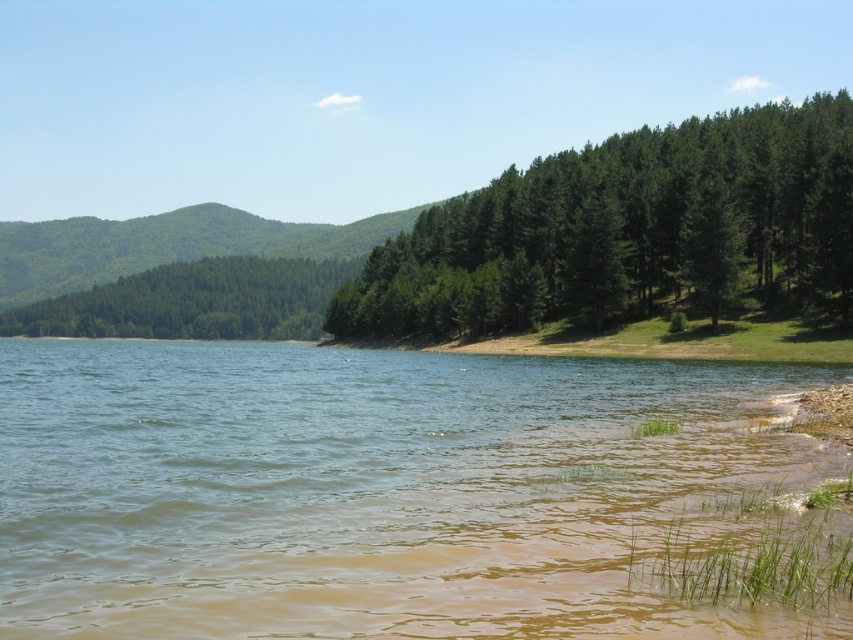
You are standing at the lakeside and want to walk to both the point at (674,604) and the point at (543,248). Which point will you reach first if you start walking towards them?

You will reach the point at (674,604) first because it is closer to you than the point at (543,248).

You are standing at the edge of the lake and want to cross to the other side. You see the brown muddy water at lower center and the green leafy trees at left. Which path would allow you to walk on solid ground without getting your feet wet?

The green leafy trees at left are wider than the brown muddy water at lower center, so walking towards the green leafy trees at left would provide a solid ground path away from the water.

You are standing at the center of the image and want to locate the green leafy trees at right. What are their coordinates?

The green leafy trees at right are located at coordinates point (628, 228).